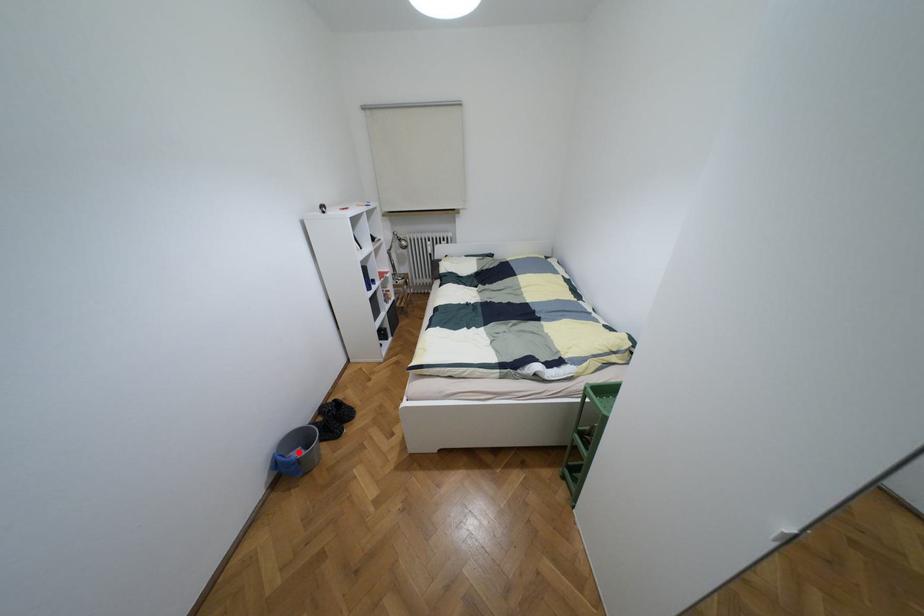
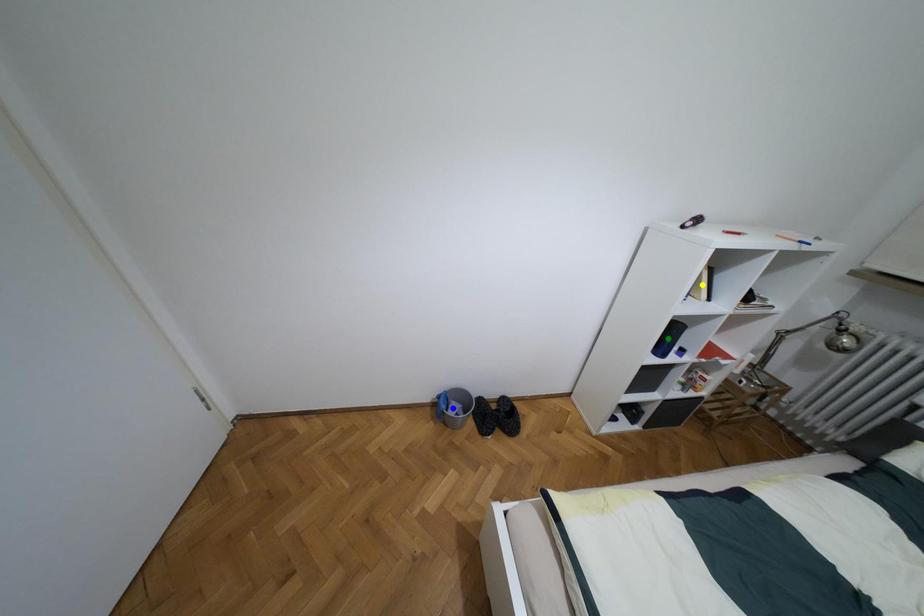
Question: I am providing you with two images of the same scene from different viewpoints. A red point is marked on the first image. You are given multiple points on the second image. Which point in image 2 is actually the same real-world point as the red point in image 1?

Choices:
 (A) yellow point
 (B) green point
 (C) blue point

Answer: (C)